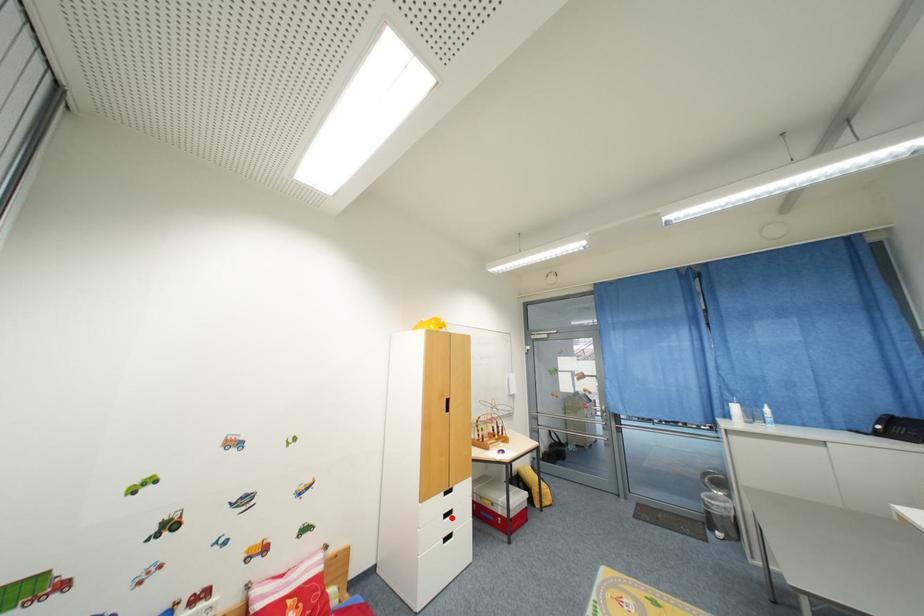
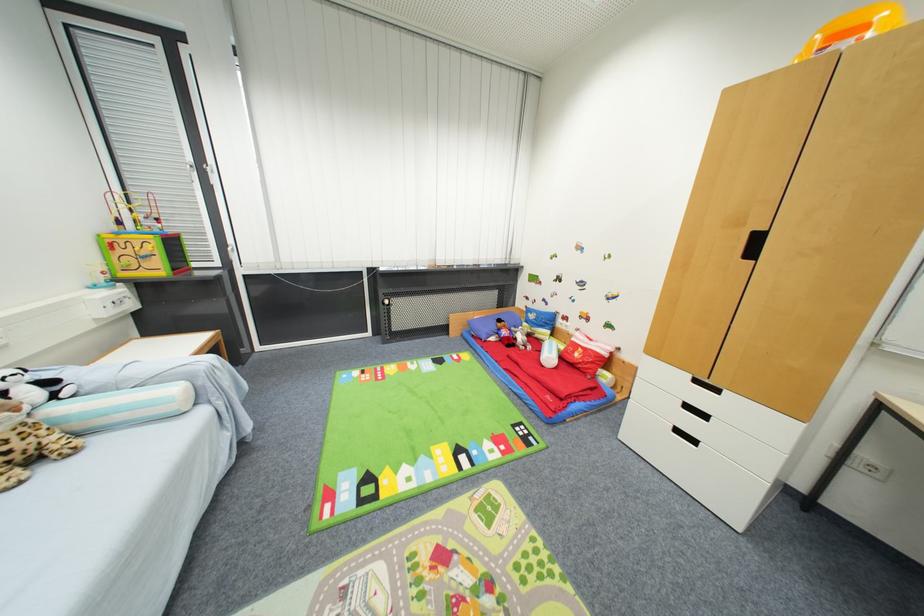
Where in the second image is the point corresponding to the highlighted location from the first image?

(691, 408)